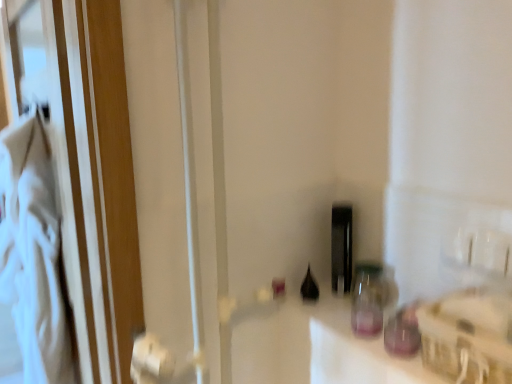
What is the approximate width of transparent glass jar at center-right, acting as the third bottle starting from the back?

transparent glass jar at center-right, acting as the third bottle starting from the back, is 3.04 inches in width.

What is the approximate height of transparent glass jar at center-right, acting as the third bottle starting from the back?

transparent glass jar at center-right, acting as the third bottle starting from the back, is 5.16 inches tall.

In order to face black glass bottle at center, which ranks as the first bottle in back-to-front order, should I rotate leftwards or rightwards?

Turn right approximately 11.775 degrees to face it.

This screenshot has width=512, height=384. In order to click on white glossy counter top at center in this screenshot , I will do `click(369, 352)`.

At what (x,y) coordinates should I click in order to perform the action: click on transparent glass bottle at center, the first bottle from the front. Please return your answer as a coordinate pair (x, y). Image resolution: width=512 pixels, height=384 pixels. Looking at the image, I should click on (403, 332).

Identify the location of transparent glass jar at center-right, acting as the third bottle starting from the back. This screenshot has width=512, height=384. (369, 298).

Does transparent glass jar at center-right, which is counted as the second bottle, starting from the front, have a larger size compared to white glossy counter top at center?

Actually, transparent glass jar at center-right, which is counted as the second bottle, starting from the front, might be smaller than white glossy counter top at center.

Could you tell me if transparent glass jar at center-right, which is counted as the second bottle, starting from the front, is facing white glossy counter top at center?

No, transparent glass jar at center-right, which is counted as the second bottle, starting from the front, does not turn towards white glossy counter top at center.

Considering the relative positions of transparent glass jar at center-right, acting as the third bottle starting from the back, and white glossy counter top at center in the image provided, is transparent glass jar at center-right, acting as the third bottle starting from the back, behind white glossy counter top at center?

Yes, transparent glass jar at center-right, acting as the third bottle starting from the back, is behind white glossy counter top at center.

Is black glass bottle at center, which ranks as the first bottle in back-to-front order, placed right next to black glass bottle at center, the 2th bottle positioned from the back?

No, black glass bottle at center, which ranks as the first bottle in back-to-front order, is not making contact with black glass bottle at center, the 2th bottle positioned from the back.

Considering the relative positions of black glass bottle at center, which is the 4th bottle in front-to-back order, and black glass bottle at center, the 2th bottle positioned from the back, in the image provided, is black glass bottle at center, which is the 4th bottle in front-to-back order, to the right of black glass bottle at center, the 2th bottle positioned from the back, from the viewer's perspective?

Indeed, black glass bottle at center, which is the 4th bottle in front-to-back order, is positioned on the right side of black glass bottle at center, the 2th bottle positioned from the back.

From the image's perspective, is black glass bottle at center, which is the 4th bottle in front-to-back order, located above or below black glass bottle at center, the 3th bottle from the front?

black glass bottle at center, which is the 4th bottle in front-to-back order, is above black glass bottle at center, the 3th bottle from the front.

The image size is (512, 384). I want to click on bottle on the left of the black glass bottle at center, which is the 4th bottle in front-to-back order, so click(x=309, y=287).

Considering the sizes of objects white glossy counter top at center and black glass bottle at center, which ranks as the first bottle in back-to-front order, in the image provided, who is bigger, white glossy counter top at center or black glass bottle at center, which ranks as the first bottle in back-to-front order,?

white glossy counter top at center is bigger.

I want to click on the 4th bottle positioned above the white glossy counter top at center (from a real-world perspective), so click(x=341, y=248).

Which object is thinner, black glass bottle at center, which ranks as the first bottle in back-to-front order, or white glossy counter top at center?

black glass bottle at center, which ranks as the first bottle in back-to-front order, is thinner.

How different are the orientations of black glass bottle at center, which ranks as the first bottle in back-to-front order, and white glossy counter top at center in degrees?

1.41 degrees.

Based on the photo, which of these two, black glass bottle at center, which is the 4th bottle in front-to-back order, or white glossy counter top at center, stands shorter?

white glossy counter top at center.

Is there a large distance between black glass bottle at center, which is the 4th bottle in front-to-back order, and white glossy counter top at center?

black glass bottle at center, which is the 4th bottle in front-to-back order, is actually quite close to white glossy counter top at center.

Which is less distant, (311, 275) or (428, 376)?

Point (311, 275) is positioned farther from the camera compared to point (428, 376).

Can we say black glass bottle at center, the 2th bottle positioned from the back, lies outside white glossy counter top at center?

Yes, black glass bottle at center, the 2th bottle positioned from the back, is not within white glossy counter top at center.

From the image's perspective, which is below, black glass bottle at center, the 3th bottle from the front, or white glossy counter top at center?

white glossy counter top at center, from the image's perspective.

Between black glass bottle at center, the 2th bottle positioned from the back, and transparent glass bottle at center, the first bottle from the front, which one has larger width?

transparent glass bottle at center, the first bottle from the front.

Can you tell me how much black glass bottle at center, the 2th bottle positioned from the back, and transparent glass bottle at center, the first bottle from the front, differ in facing direction?

black glass bottle at center, the 2th bottle positioned from the back, and transparent glass bottle at center, the first bottle from the front, are facing 0.0017 degrees away from each other.

Based on the photo, from the image's perspective, which object appears higher, black glass bottle at center, the 2th bottle positioned from the back, or transparent glass bottle at center, the first bottle from the front?

black glass bottle at center, the 2th bottle positioned from the back, from the image's perspective.

In terms of height, does black glass bottle at center, the 2th bottle positioned from the back, look taller or shorter compared to transparent glass bottle at center, the first bottle from the front?

Clearly, black glass bottle at center, the 2th bottle positioned from the back, is taller compared to transparent glass bottle at center, the first bottle from the front.

From a real-world perspective, who is located higher, transparent glass jar at center-right, acting as the third bottle starting from the back, or black glass bottle at center, which is the 4th bottle in front-to-back order?

From a 3D spatial view, black glass bottle at center, which is the 4th bottle in front-to-back order, is above.

Does transparent glass jar at center-right, which is counted as the second bottle, starting from the front, have a larger size compared to black glass bottle at center, which is the 4th bottle in front-to-back order?

No, transparent glass jar at center-right, which is counted as the second bottle, starting from the front, is not bigger than black glass bottle at center, which is the 4th bottle in front-to-back order.

Is transparent glass jar at center-right, acting as the third bottle starting from the back, far from black glass bottle at center, which is the 4th bottle in front-to-back order?

No, transparent glass jar at center-right, acting as the third bottle starting from the back, is in close proximity to black glass bottle at center, which is the 4th bottle in front-to-back order.

Is the position of transparent glass jar at center-right, acting as the third bottle starting from the back, more distant than that of black glass bottle at center, which ranks as the first bottle in back-to-front order?

No, the depth of transparent glass jar at center-right, acting as the third bottle starting from the back, is less than that of black glass bottle at center, which ranks as the first bottle in back-to-front order.

Image resolution: width=512 pixels, height=384 pixels. I want to click on bottle that is the 2nd one when counting upward from the white glossy counter top at center (from the image's perspective), so click(369, 298).

Where is `bottle to the left of black glass bottle at center, which ranks as the first bottle in back-to-front order`? bottle to the left of black glass bottle at center, which ranks as the first bottle in back-to-front order is located at coordinates tap(309, 287).

Which object lies nearer to the anchor point transparent glass jar at center-right, acting as the third bottle starting from the back, black glass bottle at center, which is the 4th bottle in front-to-back order, or transparent glass bottle at center, which is the 4th bottle from back to front?

Based on the image, transparent glass bottle at center, which is the 4th bottle from back to front, appears to be nearer to transparent glass jar at center-right, acting as the third bottle starting from the back.

From the picture: When comparing their distances from white glossy counter top at center, does black glass bottle at center, the 3th bottle from the front, or transparent glass bottle at center, the first bottle from the front, seem closer?

The object closer to white glossy counter top at center is transparent glass bottle at center, the first bottle from the front.

When comparing their distances from white glossy counter top at center, does black glass bottle at center, the 3th bottle from the front, or black glass bottle at center, which ranks as the first bottle in back-to-front order, seem further?

black glass bottle at center, which ranks as the first bottle in back-to-front order, is further to white glossy counter top at center.

Which object lies further to the anchor point transparent glass bottle at center, the first bottle from the front, black glass bottle at center, which is the 4th bottle in front-to-back order, or transparent glass jar at center-right, which is counted as the second bottle, starting from the front?

The object further to transparent glass bottle at center, the first bottle from the front, is black glass bottle at center, which is the 4th bottle in front-to-back order.

Considering their positions, is transparent glass bottle at center, the first bottle from the front, positioned closer to black glass bottle at center, the 2th bottle positioned from the back, than transparent glass jar at center-right, which is counted as the second bottle, starting from the front?

transparent glass jar at center-right, which is counted as the second bottle, starting from the front, lies closer to black glass bottle at center, the 2th bottle positioned from the back, than the other object.

Which object lies nearer to the anchor point black glass bottle at center, the 2th bottle positioned from the back, black glass bottle at center, which ranks as the first bottle in back-to-front order, or transparent glass jar at center-right, acting as the third bottle starting from the back?

black glass bottle at center, which ranks as the first bottle in back-to-front order, is closer to black glass bottle at center, the 2th bottle positioned from the back.

When comparing their distances from transparent glass bottle at center, which is the 4th bottle from back to front, does black glass bottle at center, the 2th bottle positioned from the back, or transparent glass jar at center-right, which is counted as the second bottle, starting from the front, seem further?

black glass bottle at center, the 2th bottle positioned from the back, is positioned further to the anchor transparent glass bottle at center, which is the 4th bottle from back to front.

Which object lies further to the anchor point white glossy counter top at center, transparent glass bottle at center, which is the 4th bottle from back to front, or transparent glass jar at center-right, acting as the third bottle starting from the back?

transparent glass jar at center-right, acting as the third bottle starting from the back, lies further to white glossy counter top at center than the other object.

I want to click on bottle between black glass bottle at center, the 3th bottle from the front, and transparent glass jar at center-right, acting as the third bottle starting from the back, so click(341, 248).

I want to click on bottle between white glossy counter top at center and transparent glass jar at center-right, which is counted as the second bottle, starting from the front, along the z-axis, so click(x=403, y=332).

The image size is (512, 384). I want to click on bottle positioned between transparent glass bottle at center, which is the 4th bottle from back to front, and black glass bottle at center, the 3th bottle from the front, from near to far, so click(x=369, y=298).